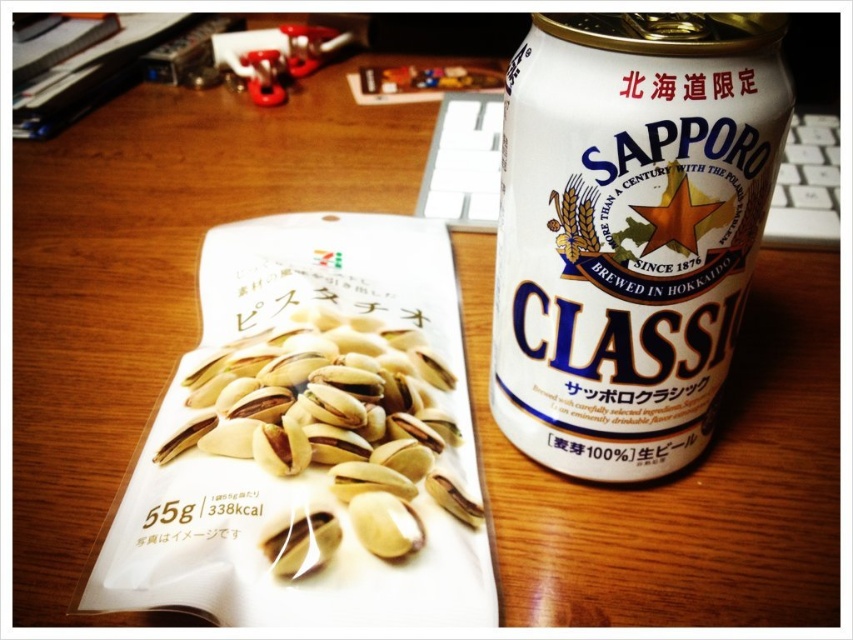
You are a delivery person who needs to place a 12 inches long package on the desk. The desk has the white matte can at right. Can you fit the package horizontally next to the can without moving it?

The distance of white matte can at right from viewer is 20.72 inches. Since the package is 12 inches long and the can is 20.72 inches away from the viewer, there is enough space to place the package horizontally next to the can without moving it.

You are organizing a small picnic basket and have both the white matte can at right and the yellow matte pistachios at center. If you want to place the larger item first to save space, which one should you put in first?

The white matte can at right is bigger than the yellow matte pistachios at center, so you should place the white matte can at right first to save space.

You are organizing a small snack table and need to place the white matte can at right and yellow matte pistachios at center. If the table is only 10 inches wide, will both items fit side by side without overlapping?

The white matte can at right is 10.52 inches away from the yellow matte pistachios at center. Since the table is only 10 inches wide, the distance between them exceeds the table width, so they cannot fit side by side without overlapping.